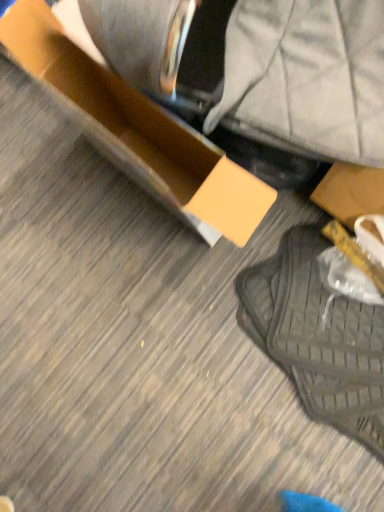
You are a GUI agent. You are given a task and a screenshot of the screen. Output one action in this format:
    pyautogui.click(x=<x>, y=<y>)
    Task: Click on the vacant space in front of matte cardboard box at center
    
    Given the screenshot: What is the action you would take?
    pyautogui.click(x=170, y=318)